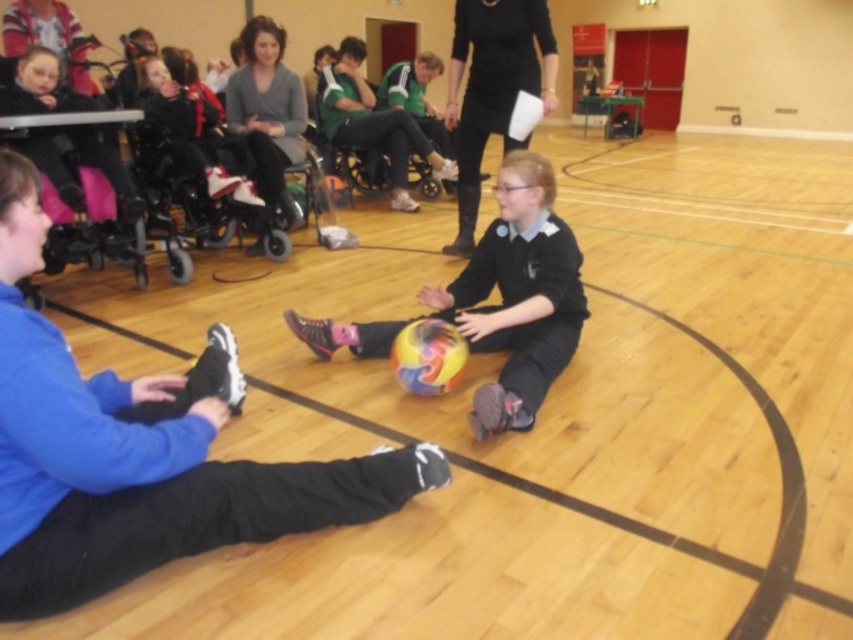
Question: Estimate the real-world distances between objects in this image. Which object is farther from the matte black wheelchair at upper left?

Choices:
 (A) grey sweater at upper center
 (B) black matte dress at center
 (C) multicolored rubber ball at center

Answer: (C)

Question: Which of these objects is positioned closest to the multicolored rubber ball at center?

Choices:
 (A) black matte dress at center
 (B) black plastic wheelchair at center
 (C) matte black wheelchair at upper left

Answer: (A)

Question: Considering the relative positions of black matte dress at center and black plastic wheelchair at center in the image provided, where is black matte dress at center located with respect to black plastic wheelchair at center?

Choices:
 (A) left
 (B) right

Answer: (B)

Question: Is the position of multicolored rubber ball at center less distant than that of grey sweater at upper center?

Choices:
 (A) no
 (B) yes

Answer: (B)

Question: Which of the following is the closest to the observer?

Choices:
 (A) matte black wheelchair at upper left
 (B) black plastic wheelchair at center
 (C) multicolored rubber ball at center
 (D) grey sweater at upper center

Answer: (C)

Question: Is multicolored rubber ball at center positioned at the back of grey sweater at upper center?

Choices:
 (A) yes
 (B) no

Answer: (B)